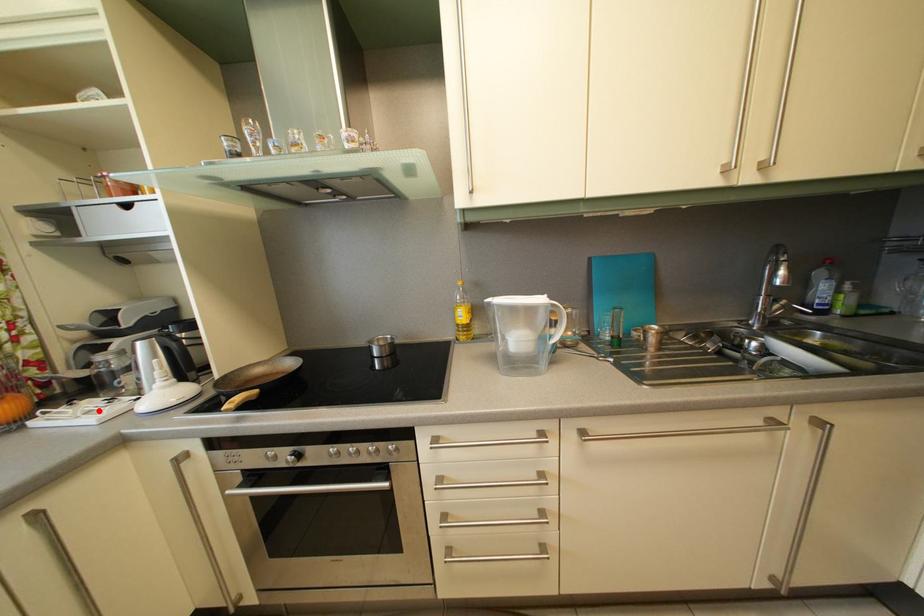
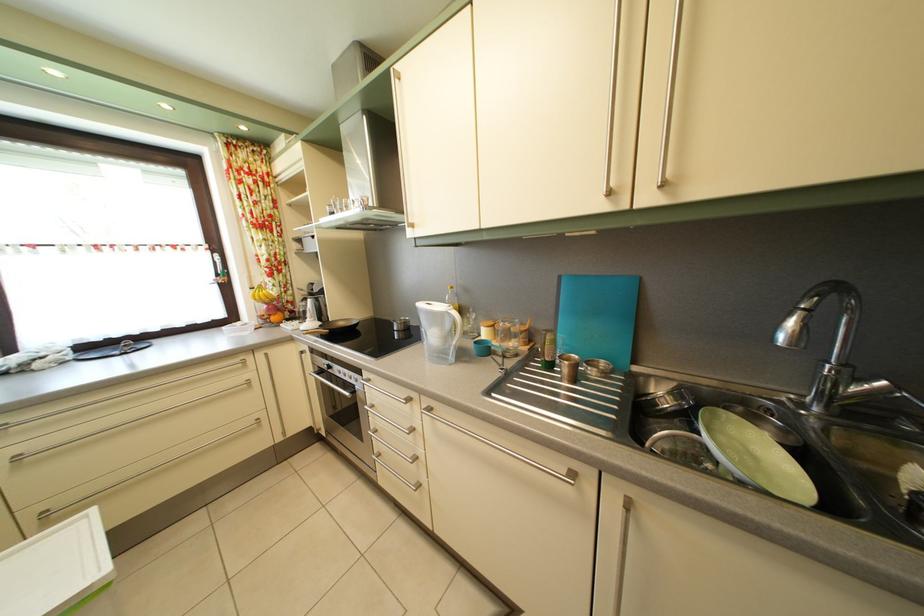
Question: I am providing you with two images of the same scene from different viewpoints. A red point is marked on the first image. Is the red point's position out of view in image 2?

Choices:
 (A) Yes
 (B) No

Answer: (B)